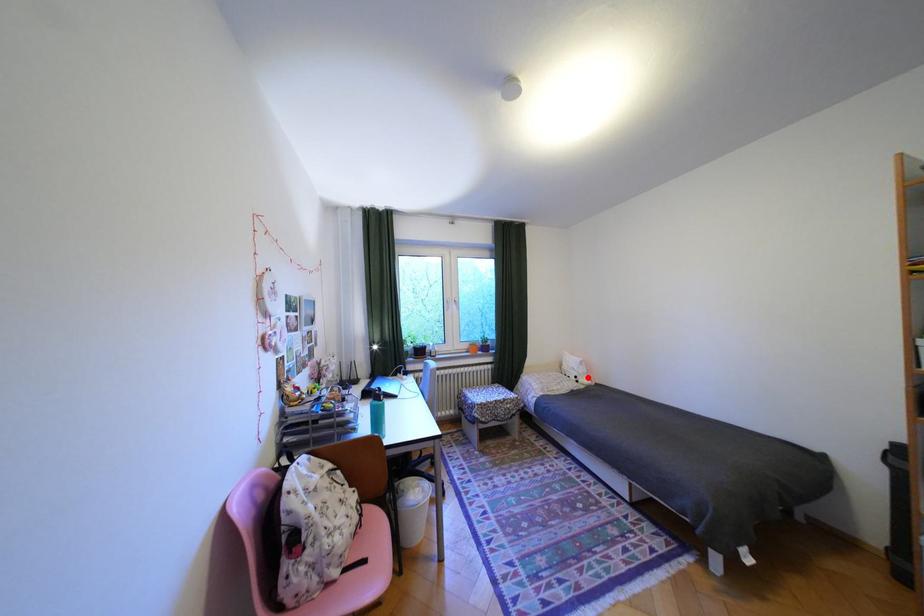
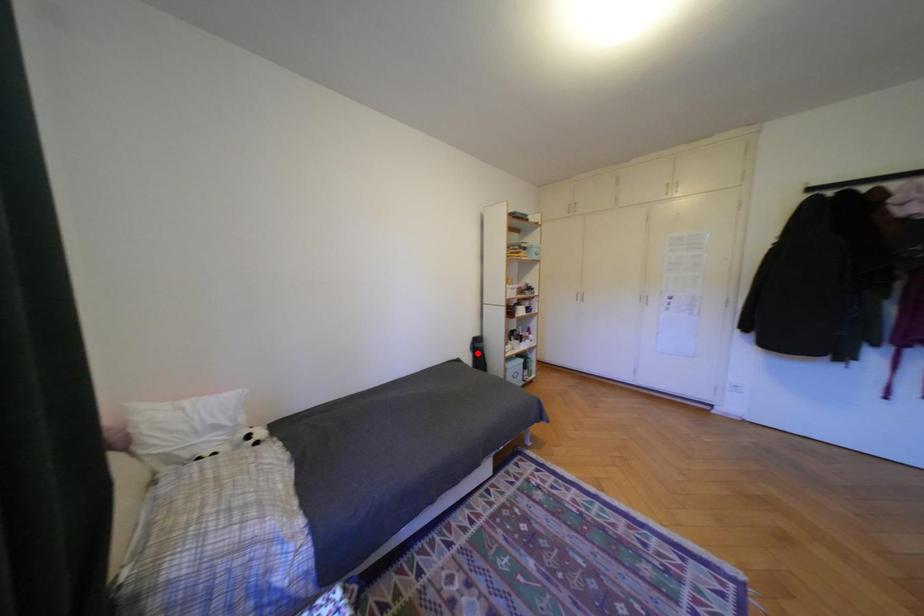
I am providing you with two images of the same scene from different viewpoints. A red point is marked on the first image and another point is marked on the second image. Is the red point in image1 aligned with the point shown in image2?

No